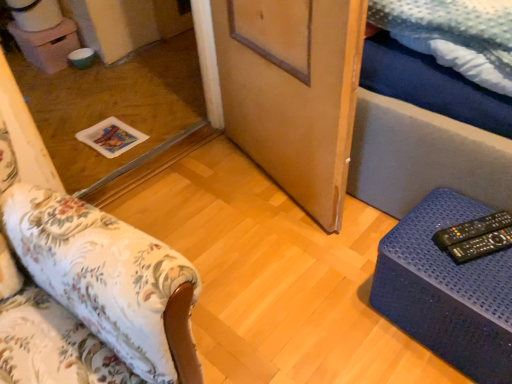
Identify the location of vacant location behind black plastic remote at lower right, which is counted as the 1th remote, starting from the back. (456, 205).